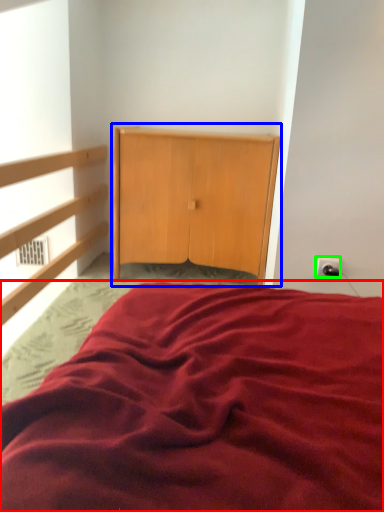
Question: Estimate the real-world distances between objects in this image. Which object is closer to bed (highlighted by a red box), dresser (highlighted by a blue box) or electric outlet (highlighted by a green box)?

Choices:
 (A) dresser
 (B) electric outlet

Answer: (B)